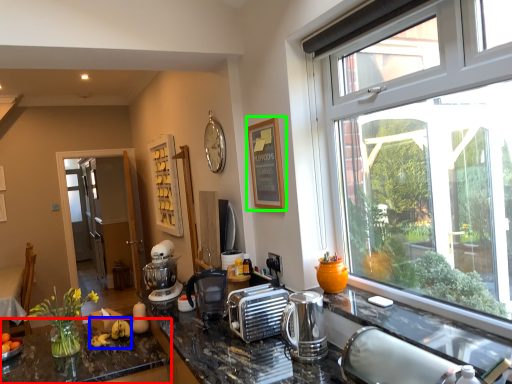
Question: Which object is the farthest from countertop (highlighted by a red box)? Choose among these: banana (highlighted by a blue box) or picture frame (highlighted by a green box).

Choices:
 (A) banana
 (B) picture frame

Answer: (B)